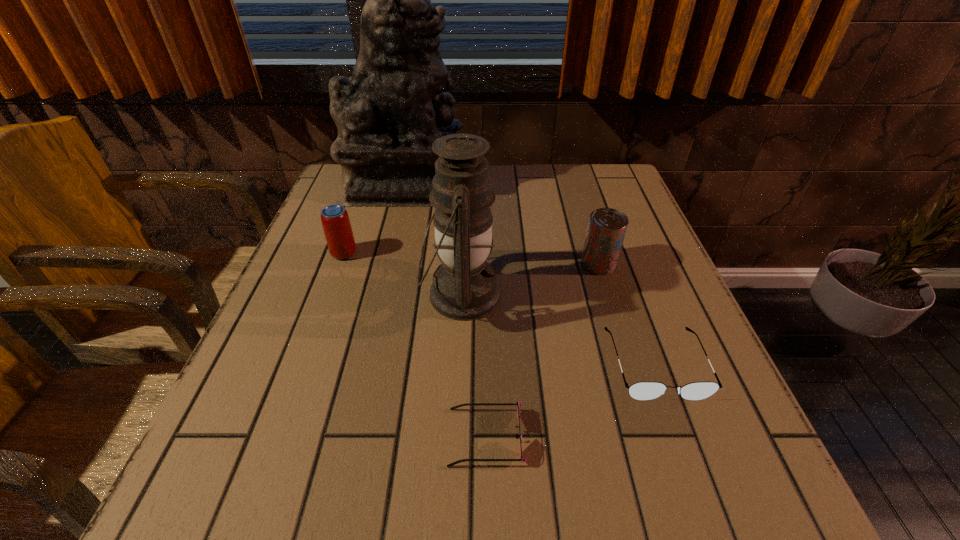
The width and height of the screenshot is (960, 540). In order to click on free space that is in between the left beer can and the farthest object in this screenshot , I will do `click(374, 219)`.

What are the coordinates of `free spot between the sunglasses and the right beer can` in the screenshot? It's located at (542, 350).

The height and width of the screenshot is (540, 960). In order to click on free space between the right beer can and the second shortest object in this screenshot , I will do `click(627, 314)`.

Identify the location of vacant space that's between the right beer can and the second shortest object. (627, 314).

Locate an element on the screen. The width and height of the screenshot is (960, 540). free spot between the second tallest object and the spectacles is located at coordinates (559, 329).

Where is `free spot between the farthest object and the spectacles`? The width and height of the screenshot is (960, 540). free spot between the farthest object and the spectacles is located at coordinates (531, 275).

The image size is (960, 540). In order to click on vacant point located between the sunglasses and the fifth tallest object in this screenshot , I will do `click(570, 401)`.

Find the location of a particular element. The width and height of the screenshot is (960, 540). object that stands as the second closest to the spectacles is located at coordinates [518, 404].

Choose which object is the fourth nearest neighbor to the nearest object. Please provide its 2D coordinates. Your answer should be formatted as a tuple, i.e. [(x, y)], where the tuple contains the x and y coordinates of a point satisfying the conditions above.

[(336, 224)]

Find the location of `free spot that satisfies the following two spatial constraints: 1. on the back side of the right beer can; 2. on the right side of the oil lamp`. free spot that satisfies the following two spatial constraints: 1. on the back side of the right beer can; 2. on the right side of the oil lamp is located at coordinates (463, 264).